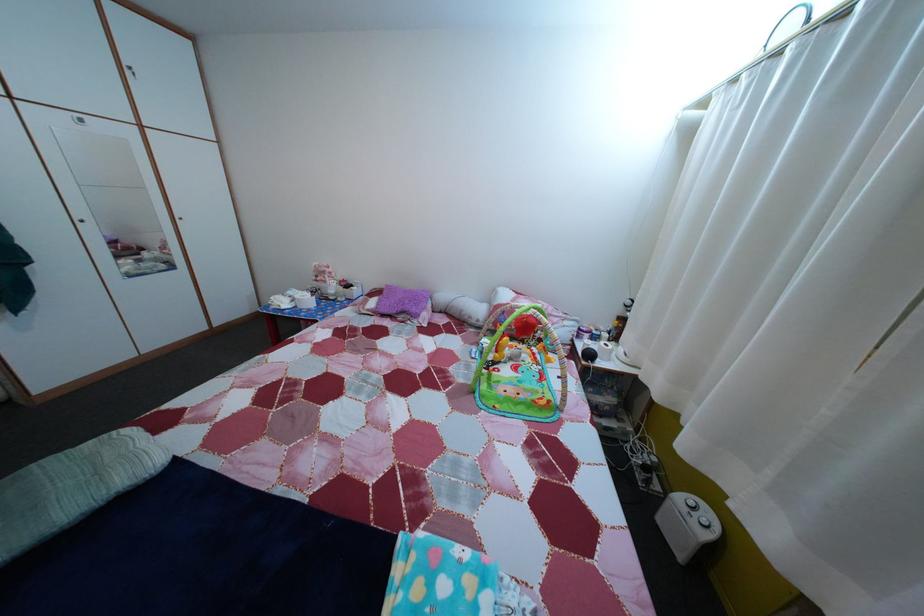
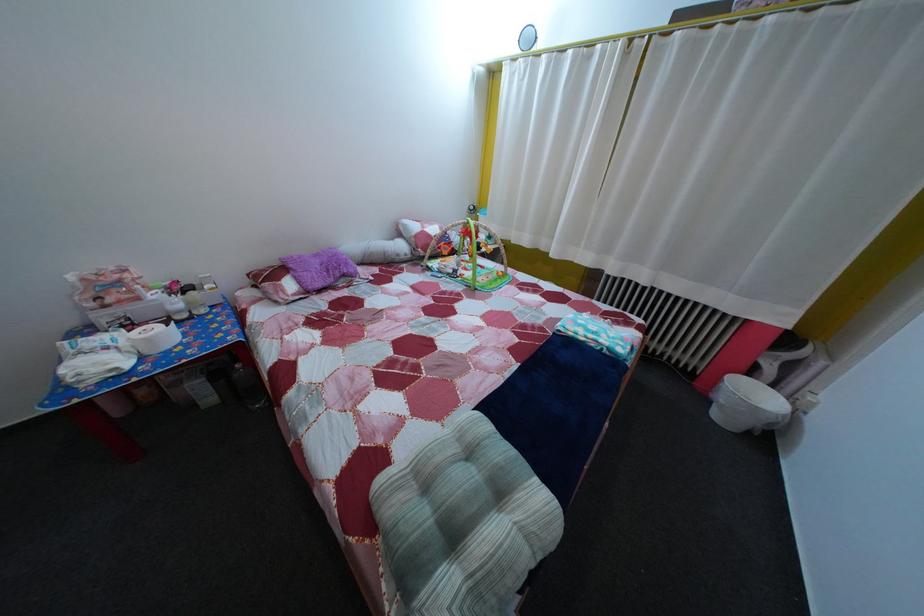
Locate, in the second image, the point that corresponds to (416,299) in the first image.

(325, 262)